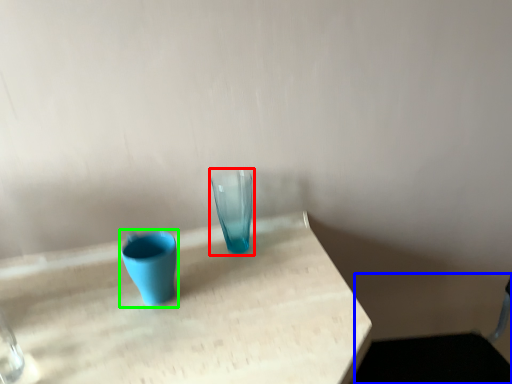
Question: Based on their relative distances, which object is nearer to vase (highlighted by a red box)? Choose from swivel chair (highlighted by a blue box) and vase (highlighted by a green box).

Choices:
 (A) swivel chair
 (B) vase

Answer: (B)